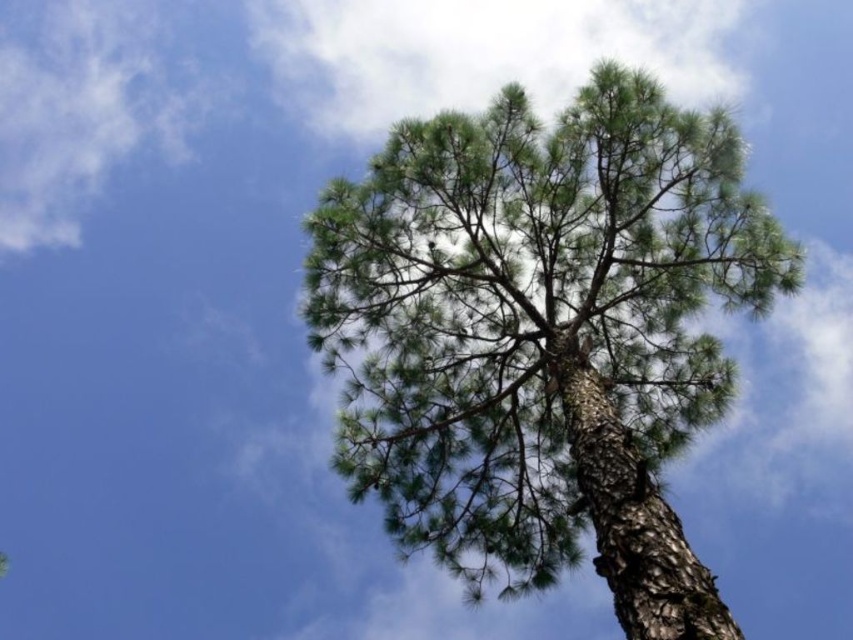
Question: Which object appears closest to the camera in this image?

Choices:
 (A) white fluffy cloud at upper center
 (B) green rough bark tree at center

Answer: (A)

Question: Does green rough bark tree at center appear under white fluffy cloud at upper center?

Choices:
 (A) no
 (B) yes

Answer: (B)

Question: From the image, what is the correct spatial relationship of green rough bark tree at center in relation to white fluffy cloud at upper center?

Choices:
 (A) below
 (B) above

Answer: (A)

Question: Can you confirm if green rough bark tree at center is smaller than white fluffy cloud at upper center?

Choices:
 (A) no
 (B) yes

Answer: (B)

Question: Which of the following is the closest to the observer?

Choices:
 (A) green rough bark tree at center
 (B) white fluffy cloud at upper center

Answer: (B)